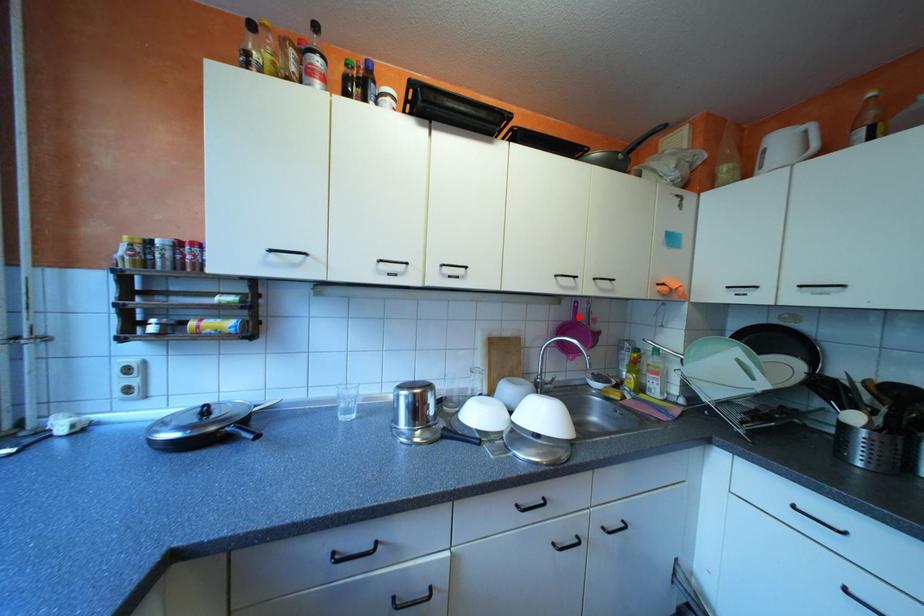
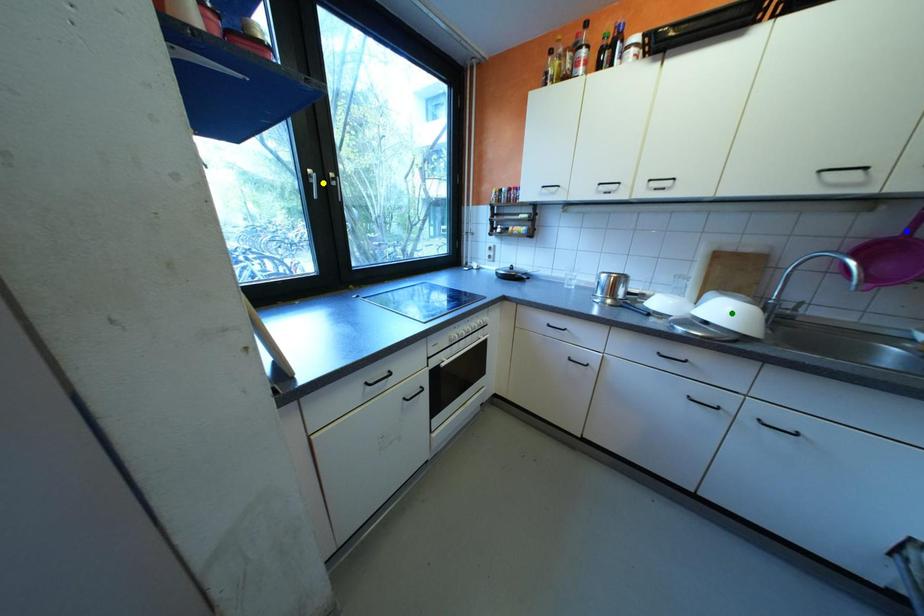
Question: I am providing you with two images of the same scene from different viewpoints. A red point is marked on the first image. You are given multiple points on the second image. Which spot in image 2 lines up with the point in image 1?

Choices:
 (A) yellow point
 (B) green point
 (C) blue point

Answer: (C)